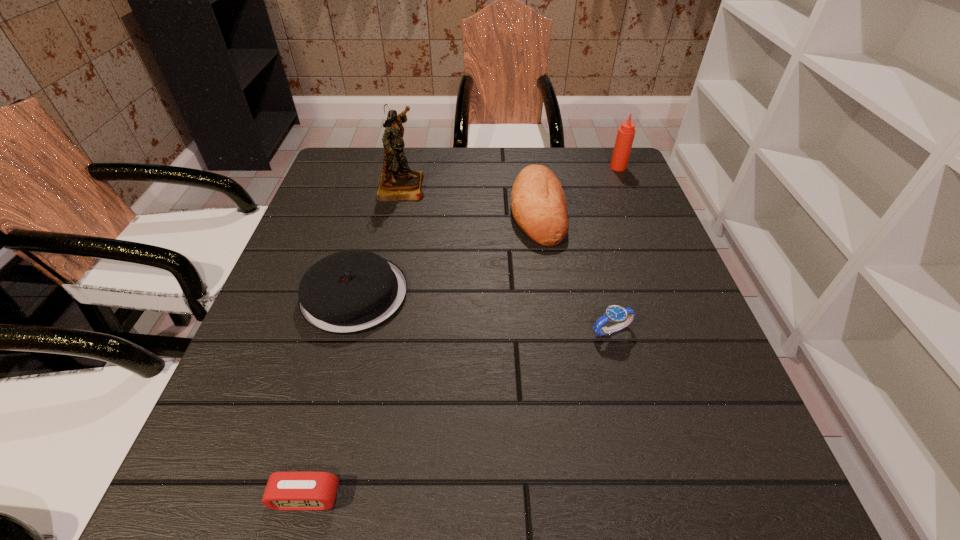
At what (x,y) coordinates should I click in order to perform the action: click on figurine. Please return your answer as a coordinate pair (x, y). This screenshot has height=540, width=960. Looking at the image, I should click on tap(398, 182).

Locate an element on the screen. Image resolution: width=960 pixels, height=540 pixels. the farthest object is located at coordinates (626, 132).

You are a GUI agent. You are given a task and a screenshot of the screen. Output one action in this format:
    pyautogui.click(x=<x>, y=<y>)
    Task: Click on the rightmost object
    
    Given the screenshot: What is the action you would take?
    pyautogui.click(x=626, y=132)

The width and height of the screenshot is (960, 540). I want to click on bread, so click(x=539, y=207).

Find the location of a particular element. Image resolution: width=960 pixels, height=540 pixels. pancake is located at coordinates (349, 292).

Where is `watch`? watch is located at coordinates (623, 316).

You are a GUI agent. You are given a task and a screenshot of the screen. Output one action in this format:
    pyautogui.click(x=<x>, y=<y>)
    Task: Click on the nearest object
    The height and width of the screenshot is (540, 960).
    Given the screenshot: What is the action you would take?
    pyautogui.click(x=294, y=491)

This screenshot has height=540, width=960. Find the location of `free space located on the front-facing side of the figurine`. free space located on the front-facing side of the figurine is located at coordinates (451, 186).

You are a GUI agent. You are given a task and a screenshot of the screen. Output one action in this format:
    pyautogui.click(x=<x>, y=<y>)
    Task: Click on the vacant space located on the back of the Tabasco sauce
    The height and width of the screenshot is (540, 960).
    Given the screenshot: What is the action you would take?
    pyautogui.click(x=612, y=151)

At what (x,y) coordinates should I click in order to perform the action: click on free space located 0.360m on the front of the bread. Please return your answer as a coordinate pair (x, y). This screenshot has height=540, width=960. Looking at the image, I should click on [564, 390].